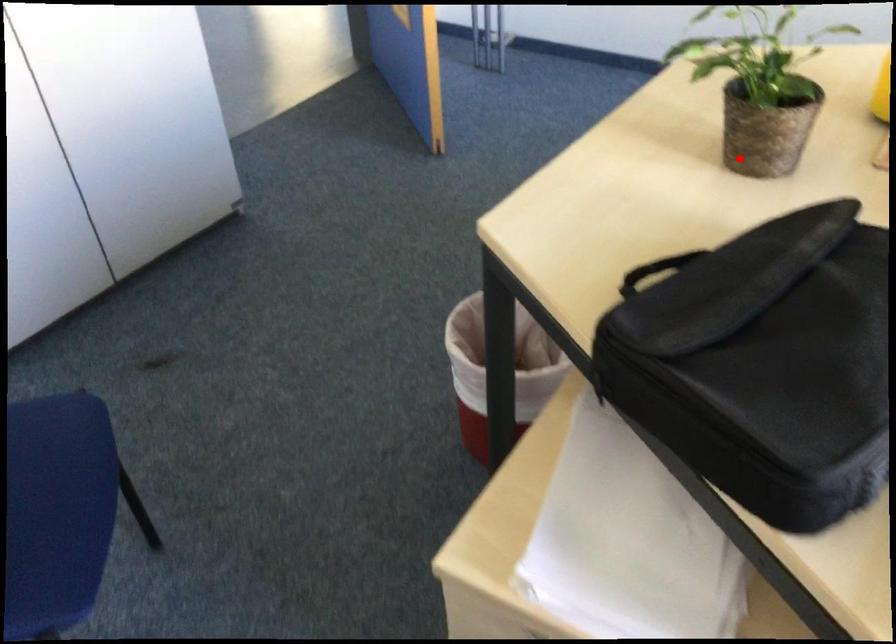
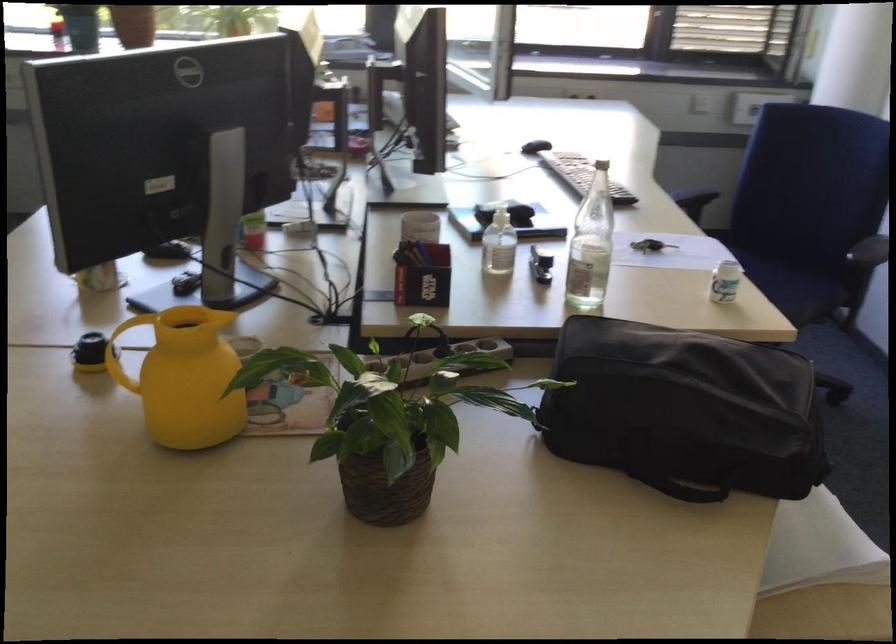
Question: A red point is marked in image1. In image2, is the corresponding 3D point closer to the camera or farther? Reply with the corresponding letter.

Choices:
 (A) The corresponding 3D point is closer.
 (B) The corresponding 3D point is farther.

Answer: (A)